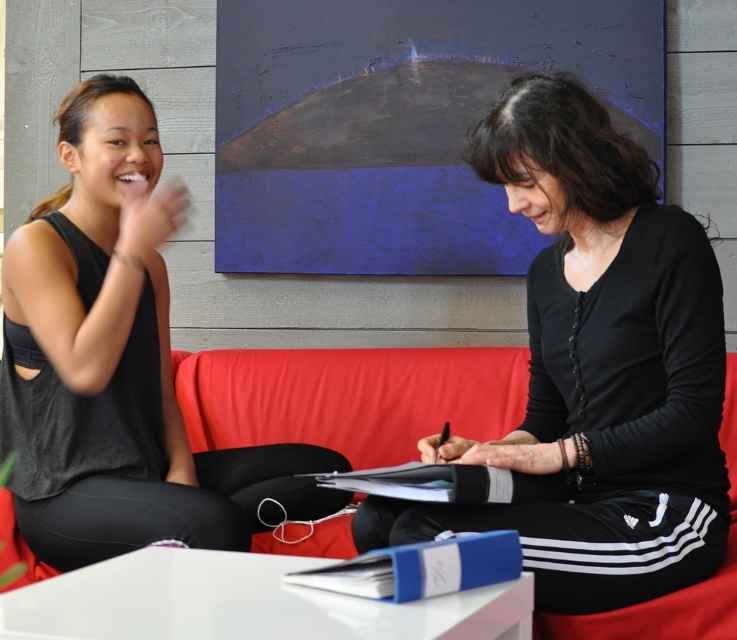
You are standing in the scene and want to place a small plant between the two points, point (621, 540) and point (83, 166). According to their positions, where should the plant be placed so it is equidistant from both points?

The plant should be placed at the midpoint between point (621, 540) and point (83, 166), which would be at coordinates calculated by averaging the x and y values of both points. The midpoint would be at x coordinate 0.553 and y coordinate 0.479, so the plant should be placed at point 0.553, 0.479 to be equidistant from both points.